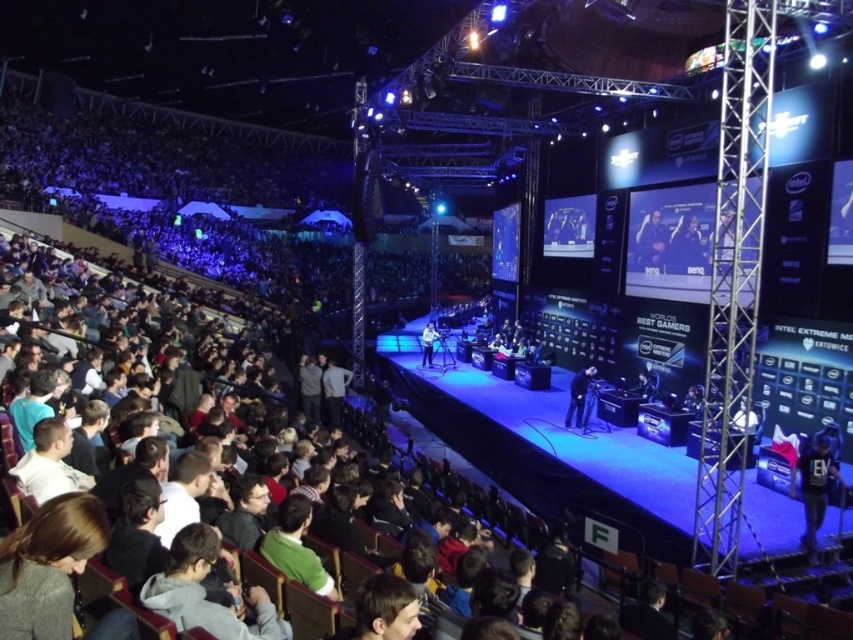
Question: Which of the following is the closest to the observer?

Choices:
 (A) black fabric at center
 (B) dark blue leather jacket at center

Answer: (A)

Question: Which of the following is the farthest from the observer?

Choices:
 (A) dark gray suit at center
 (B) black fabric at center
 (C) smooth skin face at upper center
 (D) light blue shirt at center

Answer: (D)

Question: Is smooth skin face at upper center thinner than dark gray suit at center?

Choices:
 (A) no
 (B) yes

Answer: (B)

Question: Where is dark gray suit at center located in relation to light blue shirt at center in the image?

Choices:
 (A) below
 (B) above

Answer: (A)

Question: Is black fabric at center thinner than dark blue leather jacket at center?

Choices:
 (A) no
 (B) yes

Answer: (A)

Question: Among these objects, which one is farthest from the camera?

Choices:
 (A) dark gray suit at center
 (B) smooth skin face at upper center
 (C) dark blue leather jacket at center

Answer: (C)